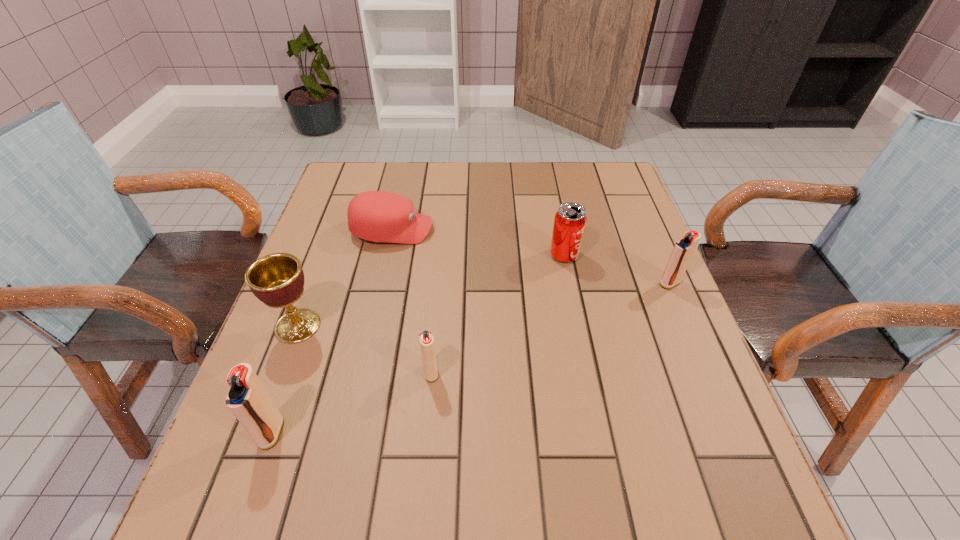
The height and width of the screenshot is (540, 960). What are the coordinates of `vacant spot for a new igniter to ensure equal spacing` in the screenshot? It's located at (562, 323).